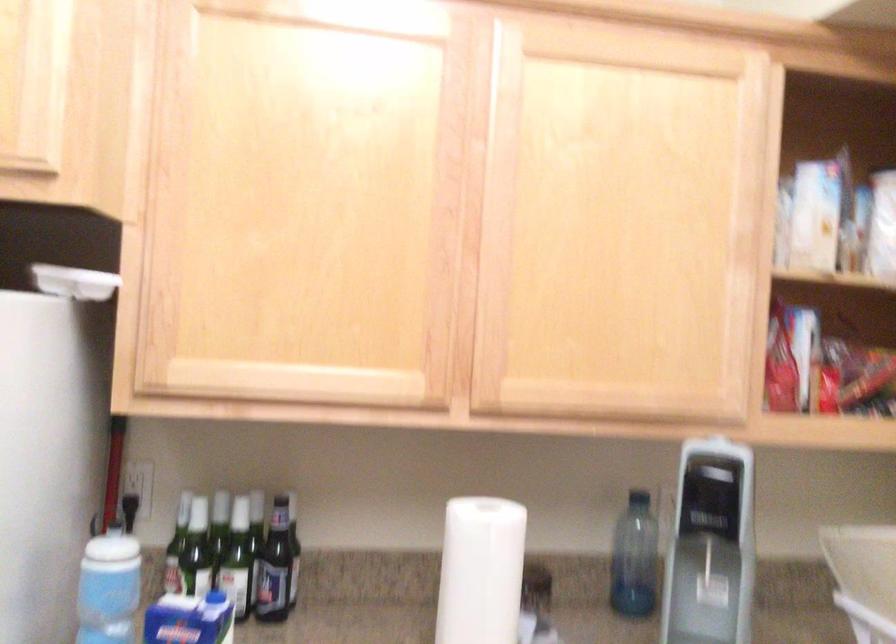
What do you see at coordinates (716, 475) in the screenshot? I see `a soda maker button` at bounding box center [716, 475].